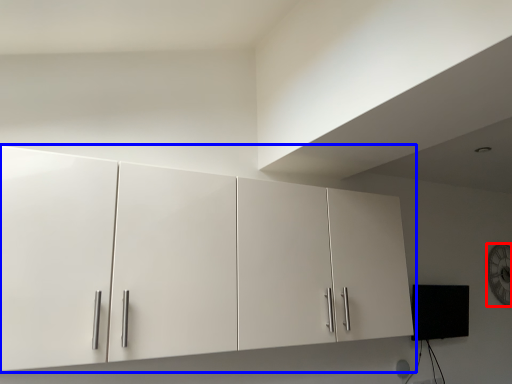
Question: Which of the following is the closest to the observer, clock (highlighted by a red box) or cupboard (highlighted by a blue box)?

Choices:
 (A) clock
 (B) cupboard

Answer: (B)